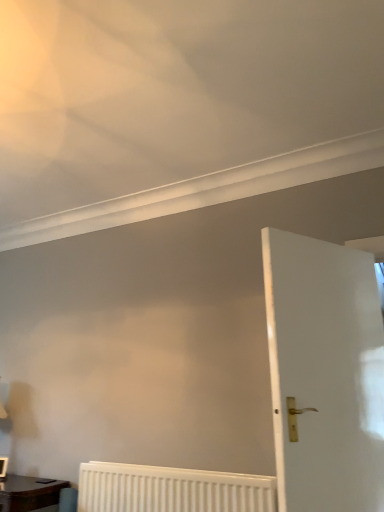
Question: Relative to matte brown wooden table at lower left, is white glossy door at right in front or behind?

Choices:
 (A) behind
 (B) front

Answer: (B)

Question: Based on their positions, is white glossy door at right located to the left or right of matte brown wooden table at lower left?

Choices:
 (A) right
 (B) left

Answer: (A)

Question: Based on their relative distances, which object is nearer to the white textured radiator at lower center?

Choices:
 (A) matte brown wooden table at lower left
 (B) white glossy door at right

Answer: (A)

Question: Based on their relative distances, which object is nearer to the matte brown wooden table at lower left?

Choices:
 (A) white glossy door at right
 (B) white textured radiator at lower center

Answer: (B)